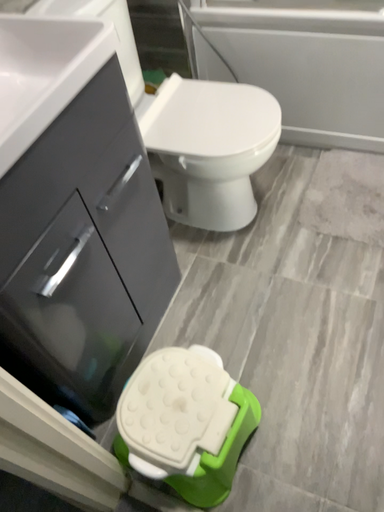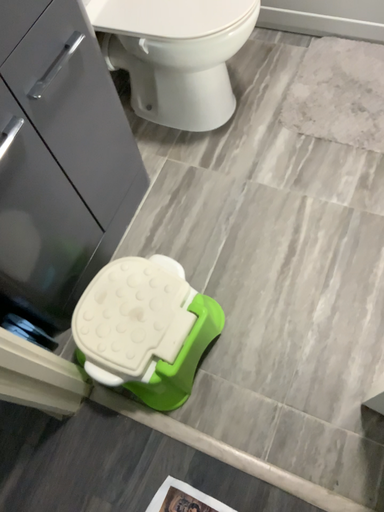
Question: How did the camera likely rotate when shooting the video?

Choices:
 (A) rotated downward
 (B) rotated upward

Answer: (A)